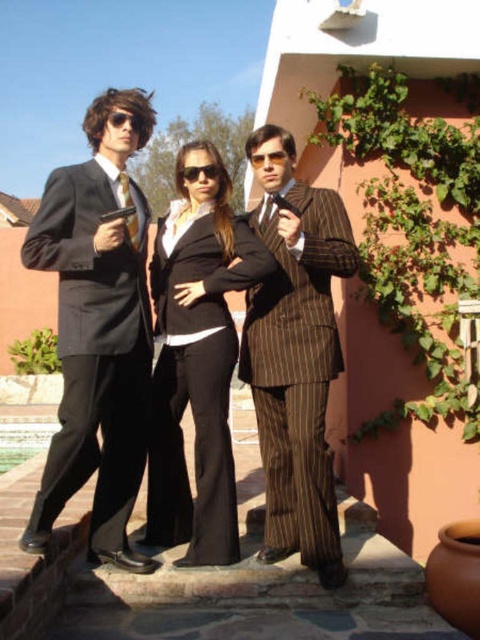
Looking at this image, you are a security guard observing the scene. You notice the matte black suit at center and the black plastic sunglasses at center. Which object is taller in the image?

The matte black suit at center is taller than the black plastic sunglasses at center.

In the scene shown: You are a tailor who needs to determine which item, the black wool blazer at center or the pinstriped fabric tie at center, requires more fabric for alterations. Based on their sizes, which one would you prioritize?

The black wool blazer at center is wider than the pinstriped fabric tie at center, so it would require more fabric for alterations and should be prioritized.

You are a photographer standing 2 meters away from the gold pinstripe suit at center and the black wool blazer at center. You want to take a photo that captures both of them in the frame. Given that your camera has a 50mm lens and you need at least 40cm between subjects for clarity, will you be able to fit both into the frame without them overlapping?

The gold pinstripe suit at center and black wool blazer at center are 41.68 centimeters apart from each other. Since the required minimum distance for clarity is 40cm and they are already 41.68cm apart, you can fit both into the frame without overlapping.